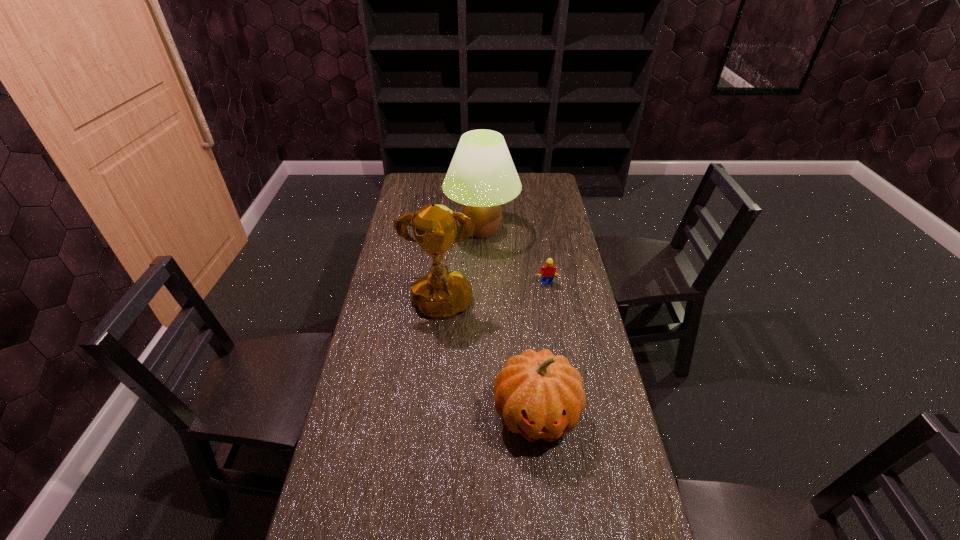
The image size is (960, 540). I want to click on free space that is in between the nearest object and the award, so click(488, 362).

Find the location of a particular element. This screenshot has height=540, width=960. vacant area that lies between the shortest object and the pumpkin is located at coordinates (540, 349).

Where is `free space between the award and the farthest object`? This screenshot has width=960, height=540. free space between the award and the farthest object is located at coordinates (461, 270).

Find the location of a particular element. This screenshot has width=960, height=540. object that stands as the closest to the nearest object is located at coordinates (440, 294).

You are a GUI agent. You are given a task and a screenshot of the screen. Output one action in this format:
    pyautogui.click(x=<x>, y=<y>)
    Task: Click on the object identified as the third closest to the award
    
    Given the screenshot: What is the action you would take?
    pyautogui.click(x=548, y=270)